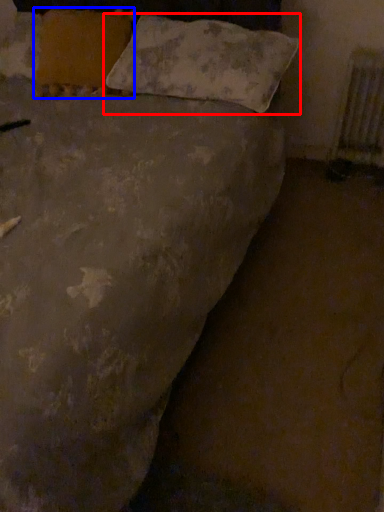
Question: Which object is closer to the camera taking this photo, pillow (highlighted by a red box) or pillow (highlighted by a blue box)?

Choices:
 (A) pillow
 (B) pillow

Answer: (A)